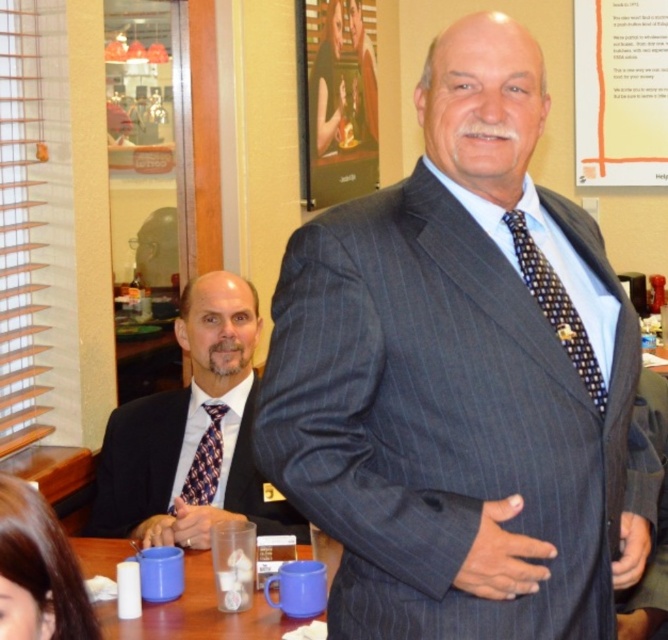
You are a fashion designer trying to create a new outfit that combines elements from both the pinstriped suit at center and the black dotted tie at center. Which item should you focus on first to ensure proper fit and proportion?

The pinstriped suit at center is wider than the black dotted tie at center, so you should focus on the pinstriped suit at center first to ensure proper fit and proportion.

Where is the black dotted tie at center located in the image?

The black dotted tie at center is located at point coordinates of 0.481 on the x axis and 0.834 on the y axis.

You are attending a formal event and need to choose between the black dotted tie at center and the plaid silk tie at center. Based on their height, which one should you pick if you want the tie to reach your belt buckle?

The black dotted tie at center is taller than the plaid silk tie at center, so you should choose the black dotted tie at center to reach your belt buckle.